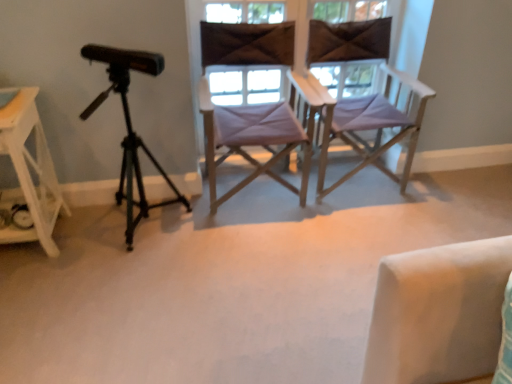
Where is `black matte tripod at left`? The image size is (512, 384). black matte tripod at left is located at coordinates (132, 148).

Measure the distance between brown fabric at center, arranged as the 1th window when viewed from the left, and camera.

They are 2.12 meters apart.

Identify the location of matte purple chair at center, placed as the 2th window when sorted from left to right. This screenshot has width=512, height=384. 243,84.

What is the approximate height of matte purple chair at center, which ranks as the 1th window in right-to-left order?

22.98 inches.

What is the approximate height of white wood side table at left?

white wood side table at left is 27.18 inches tall.

Identify the location of purple fabric chair at center, placed as the first chair when sorted from right to left. (377, 126).

Does point (129, 244) come behind point (337, 71)?

No, (129, 244) is in front of (337, 71).

How distant is black matte tripod at left from matte purple chair at center, which ranks as the 1th window in right-to-left order?

black matte tripod at left and matte purple chair at center, which ranks as the 1th window in right-to-left order, are 30.44 inches apart.

What's the angular difference between black matte tripod at left and matte purple chair at center, placed as the 2th window when sorted from left to right,'s facing directions?

2.44 degrees separate the facing orientations of black matte tripod at left and matte purple chair at center, placed as the 2th window when sorted from left to right.

From their relative heights in the image, would you say black matte tripod at left is taller or shorter than matte purple chair at center, which ranks as the 1th window in right-to-left order?

black matte tripod at left is taller than matte purple chair at center, which ranks as the 1th window in right-to-left order.

The height and width of the screenshot is (384, 512). I want to click on the 1st chair behind when counting from the black matte tripod at left, so click(x=259, y=134).

Is purple fabric chair at center, arranged as the first chair when viewed from the left, in contact with black matte tripod at left?

purple fabric chair at center, arranged as the first chair when viewed from the left, and black matte tripod at left are not in contact.

From the image's perspective, is purple fabric chair at center, marked as the 2th chair in a right-to-left arrangement, located above black matte tripod at left?

Yes, from the image's perspective, purple fabric chair at center, marked as the 2th chair in a right-to-left arrangement, is over black matte tripod at left.

Is purple fabric chair at center, arranged as the first chair when viewed from the left, aimed at black matte tripod at left?

No.

Is purple fabric chair at center, marked as the 2th chair in a right-to-left arrangement, smaller than purple fabric chair at center, which is the 2th chair from left to right?

Indeed, purple fabric chair at center, marked as the 2th chair in a right-to-left arrangement, has a smaller size compared to purple fabric chair at center, which is the 2th chair from left to right.

Is purple fabric chair at center, marked as the 2th chair in a right-to-left arrangement, situated inside purple fabric chair at center, placed as the first chair when sorted from right to left, or outside?

purple fabric chair at center, marked as the 2th chair in a right-to-left arrangement, lies outside purple fabric chair at center, placed as the first chair when sorted from right to left.

Is purple fabric chair at center, marked as the 2th chair in a right-to-left arrangement, in front of or behind purple fabric chair at center, placed as the first chair when sorted from right to left, in the image?

In the image, purple fabric chair at center, marked as the 2th chair in a right-to-left arrangement, appears in front of purple fabric chair at center, placed as the first chair when sorted from right to left.

Which is in front, point (150, 152) or point (402, 192)?

The point (150, 152) is closer.

The width and height of the screenshot is (512, 384). I want to click on chair below the black matte tripod at left (from a real-world perspective), so click(x=377, y=126).

Does black matte tripod at left turn towards purple fabric chair at center, which is the 2th chair from left to right?

No.

Is black matte tripod at left further to the viewer compared to purple fabric chair at center, placed as the first chair when sorted from right to left?

No, black matte tripod at left is closer to the viewer.

From the image's perspective, which is below, brown fabric at center, arranged as the 1th window when viewed from the left, or black matte tripod at left?

black matte tripod at left appears lower in the image.

How many degrees apart are the facing directions of brown fabric at center, positioned as the second window in right-to-left order, and black matte tripod at left?

There is a 2.67-degree angle between the facing directions of brown fabric at center, positioned as the second window in right-to-left order, and black matte tripod at left.

Do you think brown fabric at center, positioned as the second window in right-to-left order, is within black matte tripod at left, or outside of it?

brown fabric at center, positioned as the second window in right-to-left order, cannot be found inside black matte tripod at left.

Visually, is purple fabric chair at center, arranged as the first chair when viewed from the left, positioned to the left or to the right of brown fabric at center, arranged as the 1th window when viewed from the left?

In the image, purple fabric chair at center, arranged as the first chair when viewed from the left, appears on the right side of brown fabric at center, arranged as the 1th window when viewed from the left.

How different are the orientations of purple fabric chair at center, arranged as the first chair when viewed from the left, and brown fabric at center, arranged as the 1th window when viewed from the left, in degrees?

2.09 degrees separate the facing orientations of purple fabric chair at center, arranged as the first chair when viewed from the left, and brown fabric at center, arranged as the 1th window when viewed from the left.

Is purple fabric chair at center, arranged as the first chair when viewed from the left, located outside brown fabric at center, positioned as the second window in right-to-left order?

That's correct, purple fabric chair at center, arranged as the first chair when viewed from the left, is outside of brown fabric at center, positioned as the second window in right-to-left order.

Is purple fabric chair at center, marked as the 2th chair in a right-to-left arrangement, in front of or behind brown fabric at center, arranged as the 1th window when viewed from the left, in the image?

Clearly, purple fabric chair at center, marked as the 2th chair in a right-to-left arrangement, is in front of brown fabric at center, arranged as the 1th window when viewed from the left.

Which point is more distant from viewer, (3,145) or (128,152)?

The point (128,152) is farther.

Which of these two, white wood side table at left or black matte tripod at left, is wider?

black matte tripod at left is wider.

How different are the orientations of white wood side table at left and black matte tripod at left in degrees?

The facing directions of white wood side table at left and black matte tripod at left are 3.59e-05 degrees apart.

Between white wood side table at left and black matte tripod at left, which one has smaller size?

white wood side table at left.

The image size is (512, 384). What are the coordinates of `tripod on the left side of matte purple chair at center, placed as the 2th window when sorted from left to right` in the screenshot? It's located at (132, 148).

The height and width of the screenshot is (384, 512). What are the coordinates of `the 1st chair positioned above the black matte tripod at left (from the image's perspective)` in the screenshot? It's located at (259, 134).

Based on their spatial positions, is matte purple chair at center, placed as the 2th window when sorted from left to right, or brown fabric at center, arranged as the 1th window when viewed from the left, further from purple fabric chair at center, which is the 2th chair from left to right?

Among the two, brown fabric at center, arranged as the 1th window when viewed from the left, is located further to purple fabric chair at center, which is the 2th chair from left to right.

When comparing their distances from purple fabric chair at center, placed as the first chair when sorted from right to left, does matte purple chair at center, which ranks as the 1th window in right-to-left order, or purple fabric chair at center, marked as the 2th chair in a right-to-left arrangement, seem closer?

matte purple chair at center, which ranks as the 1th window in right-to-left order, is closer to purple fabric chair at center, placed as the first chair when sorted from right to left.

Looking at the image, which one is located further to white wood side table at left, brown fabric at center, arranged as the 1th window when viewed from the left, or purple fabric chair at center, arranged as the first chair when viewed from the left?

Among the two, brown fabric at center, arranged as the 1th window when viewed from the left, is located further to white wood side table at left.

Estimate the real-world distances between objects in this image. Which object is further from black matte tripod at left, brown fabric at center, arranged as the 1th window when viewed from the left, or matte purple chair at center, which ranks as the 1th window in right-to-left order?

matte purple chair at center, which ranks as the 1th window in right-to-left order, is positioned further to the anchor black matte tripod at left.

Looking at the image, which one is located closer to purple fabric chair at center, which is the 2th chair from left to right, brown fabric at center, arranged as the 1th window when viewed from the left, or black matte tripod at left?

brown fabric at center, arranged as the 1th window when viewed from the left, is positioned closer to the anchor purple fabric chair at center, which is the 2th chair from left to right.

Looking at the image, which one is located closer to matte purple chair at center, which ranks as the 1th window in right-to-left order, black matte tripod at left or purple fabric chair at center, which is the 2th chair from left to right?

purple fabric chair at center, which is the 2th chair from left to right.

Which object lies nearer to the anchor point purple fabric chair at center, arranged as the first chair when viewed from the left, black matte tripod at left or brown fabric at center, arranged as the 1th window when viewed from the left?

Among the two, brown fabric at center, arranged as the 1th window when viewed from the left, is located nearer to purple fabric chair at center, arranged as the first chair when viewed from the left.

Consider the image. From the image, which object appears to be nearer to white wood side table at left, black matte tripod at left or purple fabric chair at center, arranged as the first chair when viewed from the left?

black matte tripod at left.

Locate an element on the screen. Image resolution: width=512 pixels, height=384 pixels. chair between black matte tripod at left and matte purple chair at center, which ranks as the 1th window in right-to-left order, in the horizontal direction is located at coordinates (259, 134).

The width and height of the screenshot is (512, 384). I want to click on chair between brown fabric at center, arranged as the 1th window when viewed from the left, and purple fabric chair at center, placed as the first chair when sorted from right to left, in the horizontal direction, so click(x=259, y=134).

Where is `window between black matte tripod at left and matte purple chair at center, placed as the 2th window when sorted from left to right, from left to right`? The height and width of the screenshot is (384, 512). window between black matte tripod at left and matte purple chair at center, placed as the 2th window when sorted from left to right, from left to right is located at coordinates (246, 83).

I want to click on tripod situated between white wood side table at left and purple fabric chair at center, which is the 2th chair from left to right, from left to right, so click(x=132, y=148).